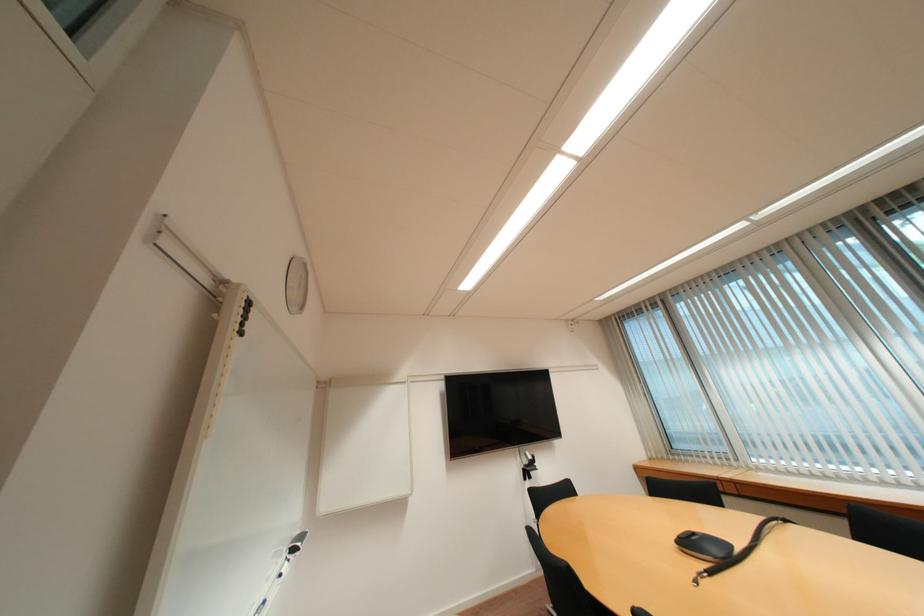
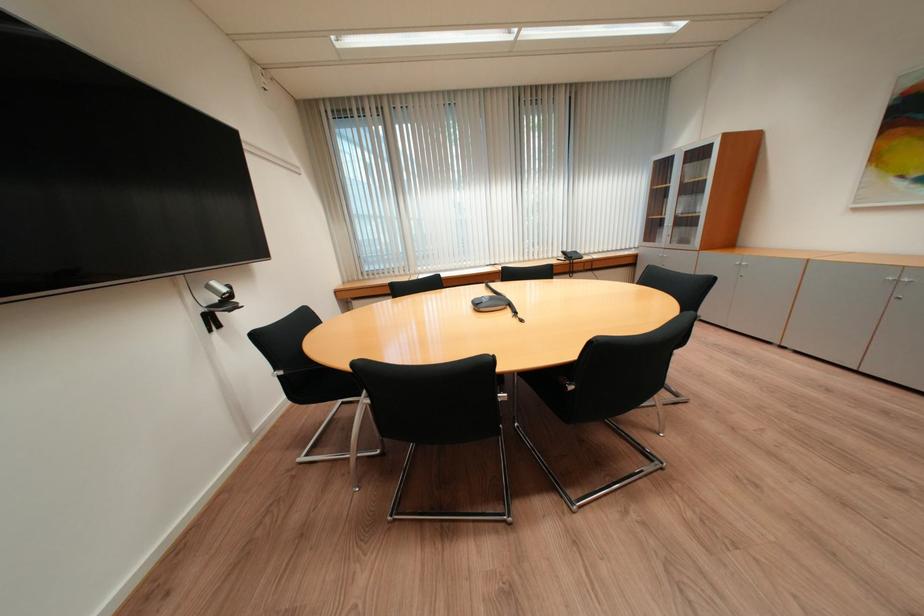
Find the pixel in the second image that matches [533,456] in the first image.

(217, 289)